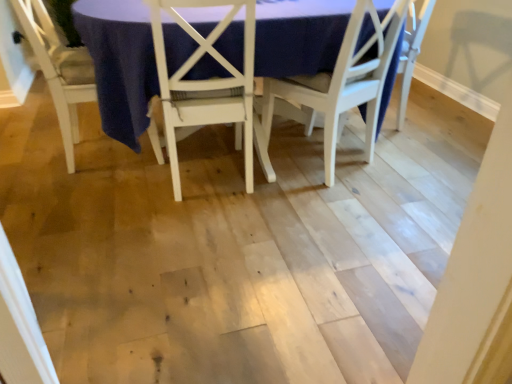
What do you see at coordinates (334, 88) in the screenshot? I see `white wood chair at center, placed as the 3th chair when sorted from left to right` at bounding box center [334, 88].

Measure the distance between white wood chair at lower left, which is the 3th chair from right to left, and camera.

The distance of white wood chair at lower left, which is the 3th chair from right to left, from camera is 5.82 feet.

You are a GUI agent. You are given a task and a screenshot of the screen. Output one action in this format:
    pyautogui.click(x=<x>, y=<y>)
    Task: Click on the white wood chair at center, which appears as the 1th chair when viewed from the right
    This screenshot has height=384, width=512.
    Given the screenshot: What is the action you would take?
    pyautogui.click(x=334, y=88)

Is matte white table at center looking in the opposite direction of white wood chair at lower left, marked as the 1th chair in a left-to-right arrangement?

No, white wood chair at lower left, marked as the 1th chair in a left-to-right arrangement, is not at the back of matte white table at center.

Is matte white table at center thinner than white wood chair at lower left, which is the 3th chair from right to left?

No.

Which is in front, matte white table at center or white wood chair at lower left, marked as the 1th chair in a left-to-right arrangement?

matte white table at center is in front.

From a real-world perspective, is matte white table at center located beneath white wood chair at lower left, marked as the 1th chair in a left-to-right arrangement?

Actually, matte white table at center is physically above white wood chair at lower left, marked as the 1th chair in a left-to-right arrangement, in the real world.

From a real-world perspective, is white wood chair at center, the 2th chair in the left-to-right sequence, beneath matte white table at center?

Correct, in the physical world, white wood chair at center, the 2th chair in the left-to-right sequence, is lower than matte white table at center.

Looking at this image, which is in front, white wood chair at center, the 2th chair in the left-to-right sequence, or matte white table at center?

matte white table at center is in front.

Is white wood chair at center, which is the second chair in right-to-left order, positioned beyond the bounds of matte white table at center?

No, most part of white wood chair at center, which is the second chair in right-to-left order, lies within matte white table at center.

Which object is positioned more to the right, white wood chair at center, which is the second chair in right-to-left order, or matte white table at center?

matte white table at center.

Is the depth of white wood chair at center, placed as the 3th chair when sorted from left to right, greater than that of matte white table at center?

Yes, it is behind matte white table at center.

Identify the location of round table located above the white wood chair at center, placed as the 3th chair when sorted from left to right (from the image's perspective). This screenshot has height=384, width=512. (120, 64).

Does white wood chair at center, which appears as the 1th chair when viewed from the right, have a larger size compared to matte white table at center?

No, white wood chair at center, which appears as the 1th chair when viewed from the right, is not bigger than matte white table at center.

How many degrees apart are the facing directions of white wood chair at center, which appears as the 1th chair when viewed from the right, and matte white table at center?

They differ by 69.2 degrees in their facing directions.

Is white wood chair at lower left, which is the 3th chair from right to left, oriented towards white wood chair at center, the 2th chair in the left-to-right sequence?

No, white wood chair at lower left, which is the 3th chair from right to left, is not facing towards white wood chair at center, the 2th chair in the left-to-right sequence.

Does white wood chair at lower left, marked as the 1th chair in a left-to-right arrangement, come behind white wood chair at center, the 2th chair in the left-to-right sequence?

Yes.

In terms of width, does white wood chair at lower left, which is the 3th chair from right to left, look wider or thinner when compared to white wood chair at center, the 2th chair in the left-to-right sequence?

Considering their sizes, white wood chair at lower left, which is the 3th chair from right to left, looks broader than white wood chair at center, the 2th chair in the left-to-right sequence.

From a real-world perspective, is white wood chair at lower left, marked as the 1th chair in a left-to-right arrangement, over white wood chair at center, which appears as the 1th chair when viewed from the right?

No, from a real-world perspective, white wood chair at lower left, marked as the 1th chair in a left-to-right arrangement, is not on top of white wood chair at center, which appears as the 1th chair when viewed from the right.

Which of these two, white wood chair at lower left, which is the 3th chair from right to left, or white wood chair at center, which appears as the 1th chair when viewed from the right, is smaller?

white wood chair at center, which appears as the 1th chair when viewed from the right.

Is white wood chair at lower left, marked as the 1th chair in a left-to-right arrangement, behind white wood chair at center, placed as the 3th chair when sorted from left to right?

Yes.

Is white wood chair at lower left, which is the 3th chair from right to left, wider or thinner than white wood chair at center, which appears as the 1th chair when viewed from the right?

white wood chair at lower left, which is the 3th chair from right to left, is wider than white wood chair at center, which appears as the 1th chair when viewed from the right.

Who is taller, white wood chair at center, the 2th chair in the left-to-right sequence, or white wood chair at center, placed as the 3th chair when sorted from left to right?

white wood chair at center, the 2th chair in the left-to-right sequence.

From the image's perspective, which is above, white wood chair at center, the 2th chair in the left-to-right sequence, or white wood chair at center, which appears as the 1th chair when viewed from the right?

From the image's view, white wood chair at center, which appears as the 1th chair when viewed from the right, is above.

Which of these two, white wood chair at center, the 2th chair in the left-to-right sequence, or white wood chair at center, placed as the 3th chair when sorted from left to right, is smaller?

Smaller between the two is white wood chair at center, placed as the 3th chair when sorted from left to right.

Is white wood chair at center, which is the second chair in right-to-left order, positioned far away from white wood chair at center, placed as the 3th chair when sorted from left to right?

No, white wood chair at center, which is the second chair in right-to-left order, is in close proximity to white wood chair at center, placed as the 3th chair when sorted from left to right.

Consider the image. What's the angular difference between matte white table at center and white wood chair at center, the 2th chair in the left-to-right sequence,'s facing directions?

88.3 degrees.

From the image's perspective, between matte white table at center and white wood chair at center, which is the second chair in right-to-left order, who is located below?

white wood chair at center, which is the second chair in right-to-left order, is shown below in the image.

Considering the relative sizes of matte white table at center and white wood chair at center, the 2th chair in the left-to-right sequence, in the image provided, is matte white table at center thinner than white wood chair at center, the 2th chair in the left-to-right sequence,?

In fact, matte white table at center might be wider than white wood chair at center, the 2th chair in the left-to-right sequence.

Identify the location of the 1st chair counting from the left of the matte white table at center. The height and width of the screenshot is (384, 512). (206, 83).

The height and width of the screenshot is (384, 512). Identify the location of round table that appears above the white wood chair at lower left, marked as the 1th chair in a left-to-right arrangement (from the image's perspective). (120, 64).

Where is `round table located above the white wood chair at center, the 2th chair in the left-to-right sequence (from a real-world perspective)`? This screenshot has height=384, width=512. round table located above the white wood chair at center, the 2th chair in the left-to-right sequence (from a real-world perspective) is located at coordinates (120, 64).

From the image, which object appears to be farther from matte white table at center, white wood chair at lower left, which is the 3th chair from right to left, or white wood chair at center, placed as the 3th chair when sorted from left to right?

white wood chair at lower left, which is the 3th chair from right to left, lies further to matte white table at center than the other object.

Estimate the real-world distances between objects in this image. Which object is closer to matte white table at center, white wood chair at center, which appears as the 1th chair when viewed from the right, or white wood chair at center, which is the second chair in right-to-left order?

The object closer to matte white table at center is white wood chair at center, which is the second chair in right-to-left order.

Looking at the image, which one is located further to white wood chair at center, which appears as the 1th chair when viewed from the right, white wood chair at lower left, which is the 3th chair from right to left, or white wood chair at center, which is the second chair in right-to-left order?

white wood chair at lower left, which is the 3th chair from right to left, is positioned further to the anchor white wood chair at center, which appears as the 1th chair when viewed from the right.

From the image, which object appears to be nearer to white wood chair at center, which appears as the 1th chair when viewed from the right, white wood chair at center, which is the second chair in right-to-left order, or white wood chair at lower left, which is the 3th chair from right to left?

The object closer to white wood chair at center, which appears as the 1th chair when viewed from the right, is white wood chair at center, which is the second chair in right-to-left order.

Considering their positions, is white wood chair at center, the 2th chair in the left-to-right sequence, positioned further to white wood chair at lower left, marked as the 1th chair in a left-to-right arrangement, than white wood chair at center, placed as the 3th chair when sorted from left to right?

The object further to white wood chair at lower left, marked as the 1th chair in a left-to-right arrangement, is white wood chair at center, placed as the 3th chair when sorted from left to right.

Which object lies further to the anchor point matte white table at center, white wood chair at lower left, marked as the 1th chair in a left-to-right arrangement, or white wood chair at center, which is the second chair in right-to-left order?

white wood chair at lower left, marked as the 1th chair in a left-to-right arrangement, is positioned further to the anchor matte white table at center.

Looking at the image, which one is located further to matte white table at center, white wood chair at center, which is the second chair in right-to-left order, or white wood chair at center, which appears as the 1th chair when viewed from the right?

The object further to matte white table at center is white wood chair at center, which appears as the 1th chair when viewed from the right.

When comparing their distances from white wood chair at center, which appears as the 1th chair when viewed from the right, does white wood chair at lower left, marked as the 1th chair in a left-to-right arrangement, or matte white table at center seem further?

Among the two, white wood chair at lower left, marked as the 1th chair in a left-to-right arrangement, is located further to white wood chair at center, which appears as the 1th chair when viewed from the right.

Where is `round table between white wood chair at center, which is the second chair in right-to-left order, and white wood chair at center, which appears as the 1th chair when viewed from the right, in the horizontal direction`? round table between white wood chair at center, which is the second chair in right-to-left order, and white wood chair at center, which appears as the 1th chair when viewed from the right, in the horizontal direction is located at coordinates (120, 64).

You are a GUI agent. You are given a task and a screenshot of the screen. Output one action in this format:
    pyautogui.click(x=<x>, y=<y>)
    Task: Click on the round table between white wood chair at lower left, which is the 3th chair from right to left, and white wood chair at center, which appears as the 1th chair when viewed from the right
    The width and height of the screenshot is (512, 384).
    Given the screenshot: What is the action you would take?
    pyautogui.click(x=120, y=64)

Find the location of a particular element. This screenshot has height=384, width=512. chair between white wood chair at lower left, marked as the 1th chair in a left-to-right arrangement, and matte white table at center from left to right is located at coordinates (206, 83).

Locate an element on the screen. This screenshot has width=512, height=384. chair located between white wood chair at lower left, which is the 3th chair from right to left, and white wood chair at center, which appears as the 1th chair when viewed from the right, in the left-right direction is located at coordinates (206, 83).